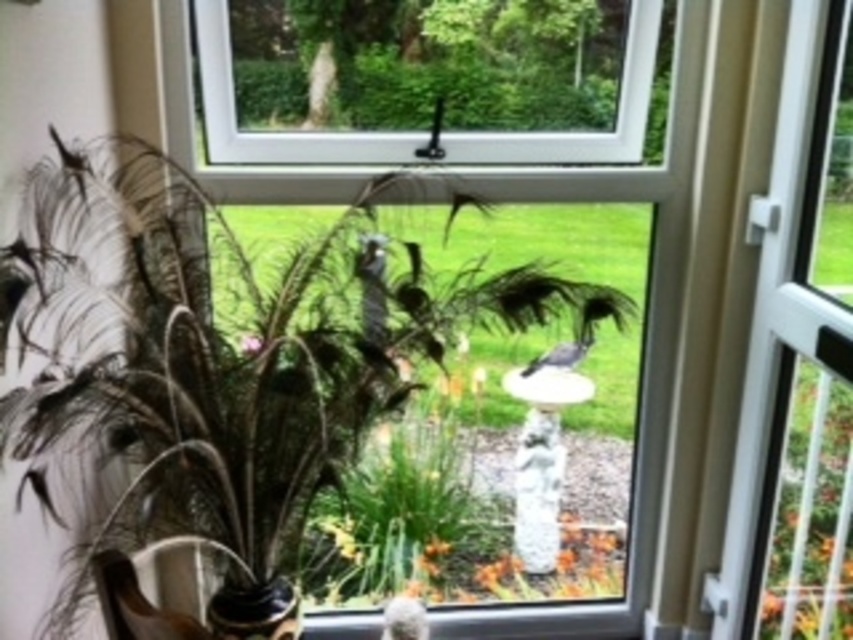
Identify the location of feathered vase at left. (303, 388).

Consider the image. Is white plastic screen door at right positioned behind gray matte bird at center?

No, it is not.

Can you confirm if white plastic screen door at right is taller than gray matte bird at center?

Indeed, white plastic screen door at right has a greater height compared to gray matte bird at center.

From the picture: Who is more distant from viewer, (796, 320) or (575, 355)?

Positioned behind is point (575, 355).

Locate an element on the screen. The height and width of the screenshot is (640, 853). white plastic screen door at right is located at coordinates (798, 362).

Does green leafy plant at lower right appear over white fluffy bird at lower center?

Correct, green leafy plant at lower right is located above white fluffy bird at lower center.

Identify the location of green leafy plant at lower right. (811, 515).

Which is behind, point (839, 472) or point (415, 632)?

The point (415, 632) is more distant.

Image resolution: width=853 pixels, height=640 pixels. In order to click on green leafy plant at lower right in this screenshot , I will do `click(811, 515)`.